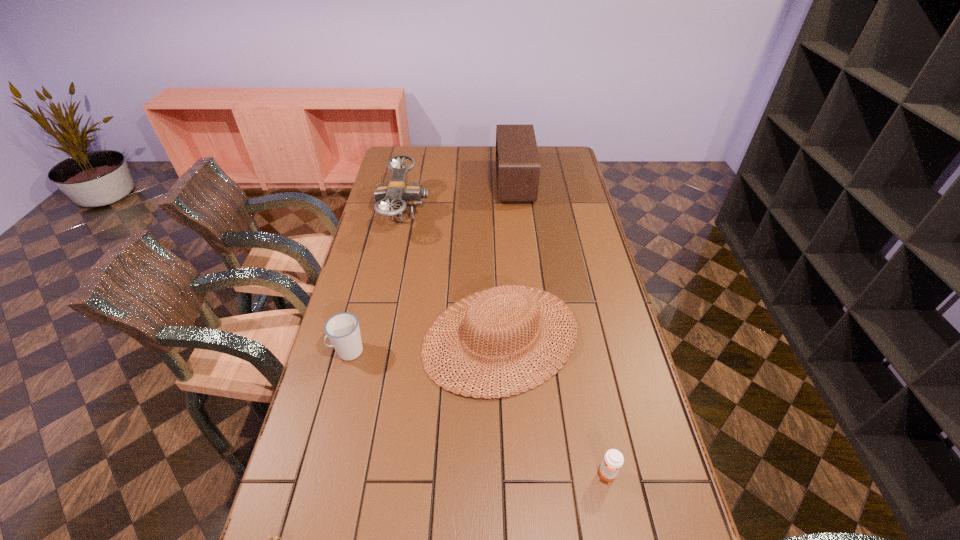
The image size is (960, 540). Find the location of `free space that satisfies the following two spatial constraints: 1. on the front-facing side of the second nearest object; 2. on the right side of the radio receiver`. free space that satisfies the following two spatial constraints: 1. on the front-facing side of the second nearest object; 2. on the right side of the radio receiver is located at coordinates (544, 475).